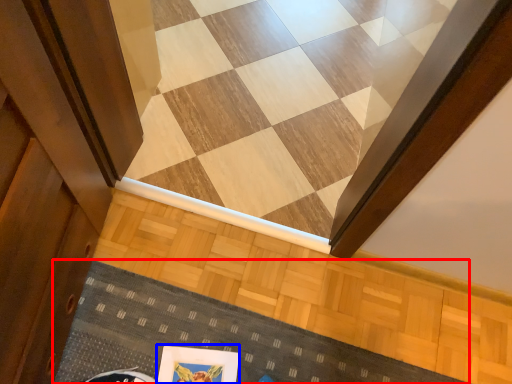
Question: Among these objects, which one is nearest to the camera, doormat (highlighted by a red box) or picture frame (highlighted by a blue box)?

Choices:
 (A) doormat
 (B) picture frame

Answer: (B)